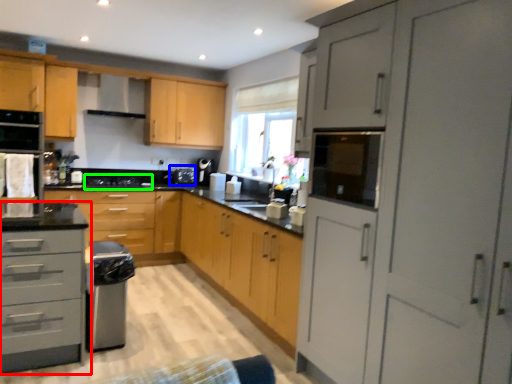
Question: Which is nearer to the cabinetry (highlighted by a red box)? appliance (highlighted by a blue box) or gas stove (highlighted by a green box).

Choices:
 (A) appliance
 (B) gas stove

Answer: (B)